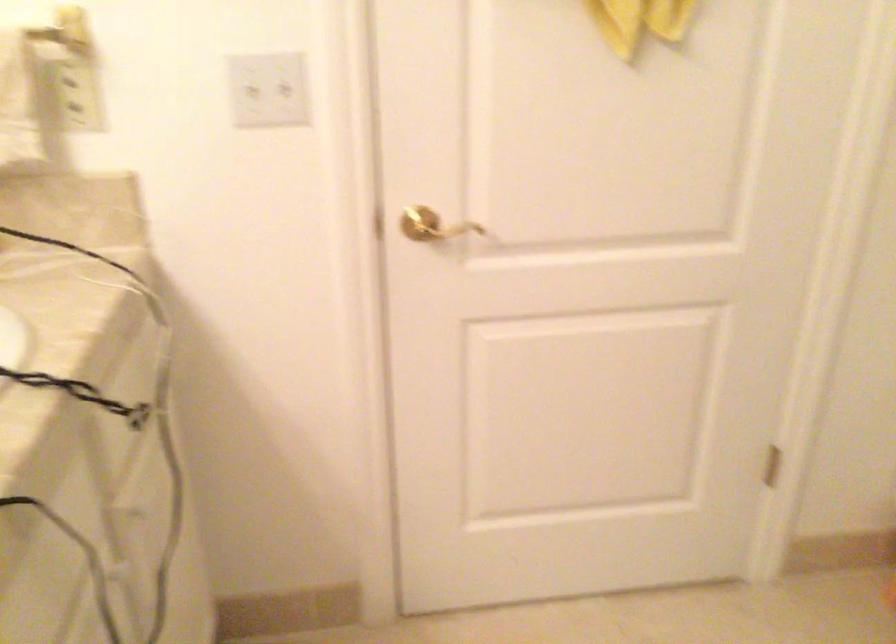
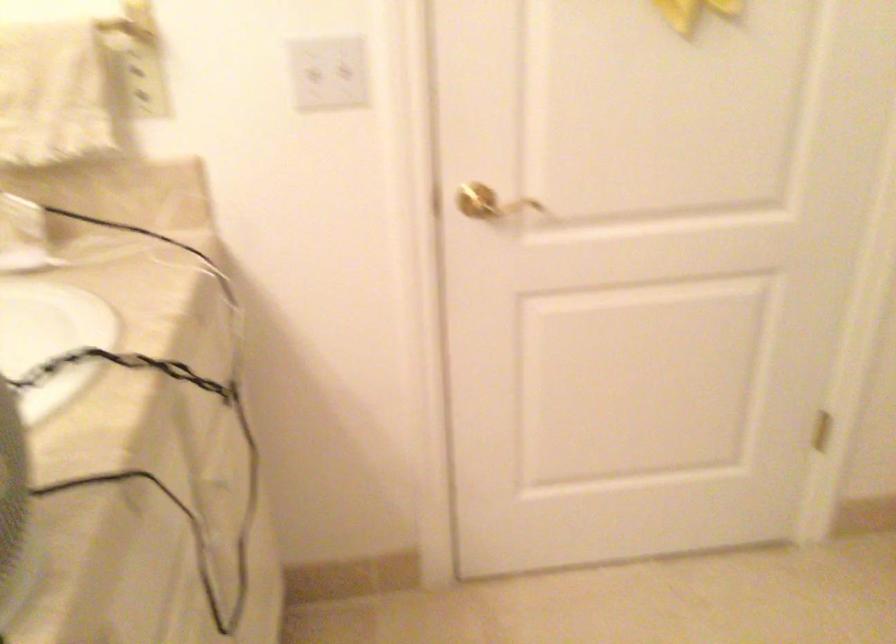
What movement of the cameraman would produce the second image?

The cameraman moved toward left, backward.